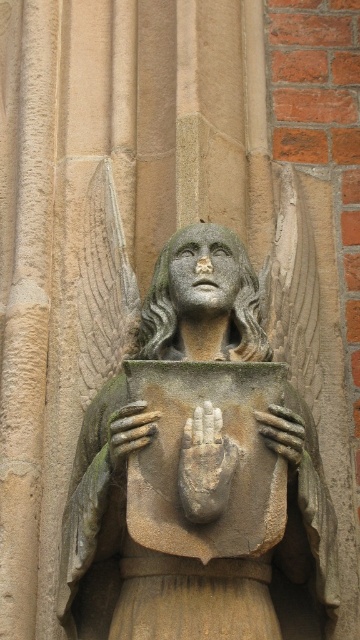
Is smooth stone hand at center to the right of stone textured hand at center from the viewer's perspective?

No, smooth stone hand at center is not to the right of stone textured hand at center.

Is smooth stone hand at center positioned behind stone textured hand at center?

No, smooth stone hand at center is closer to the viewer.

Who is more forward, (151,412) or (286,429)?

Point (151,412)

At what (x,y) coordinates should I click in order to perform the action: click on smooth stone hand at center. Please return your answer as a coordinate pair (x, y). This screenshot has height=640, width=360. Looking at the image, I should click on (129, 429).

Is stone statue at center below stone textured hand at center?

Yes.

Consider the image. Does stone statue at center appear on the left side of stone textured hand at center?

Correct, you'll find stone statue at center to the left of stone textured hand at center.

This screenshot has height=640, width=360. What are the coordinates of `stone statue at center` in the screenshot? It's located at (182, 557).

How much distance is there between stone statue at center and smooth stone hand at center?

They are 15.35 feet apart.

Which is more to the left, stone statue at center or smooth stone hand at center?

From the viewer's perspective, smooth stone hand at center appears more on the left side.

Describe the element at coordinates (182, 557) in the screenshot. This screenshot has height=640, width=360. I see `stone statue at center` at that location.

This screenshot has height=640, width=360. I want to click on stone statue at center, so click(182, 557).